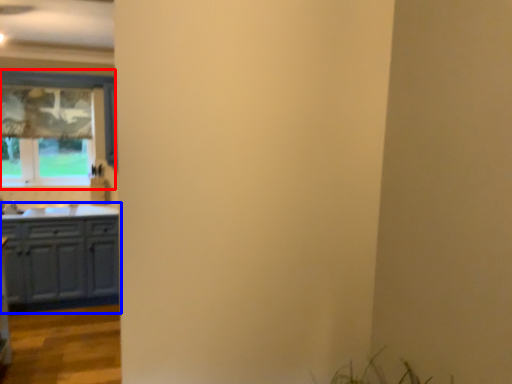
Question: Among these objects, which one is farthest to the camera, window (highlighted by a red box) or cabinetry (highlighted by a blue box)?

Choices:
 (A) window
 (B) cabinetry

Answer: (A)